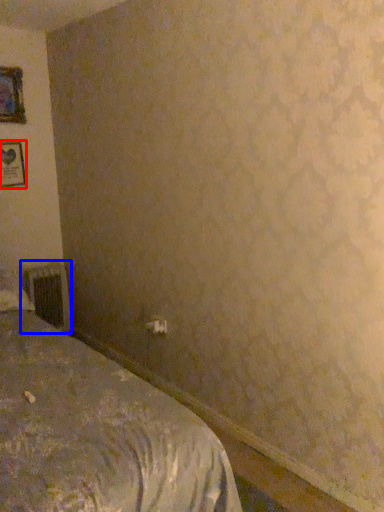
Question: Which object is further to the camera taking this photo, picture frame (highlighted by a red box) or radiator (highlighted by a blue box)?

Choices:
 (A) picture frame
 (B) radiator

Answer: (B)